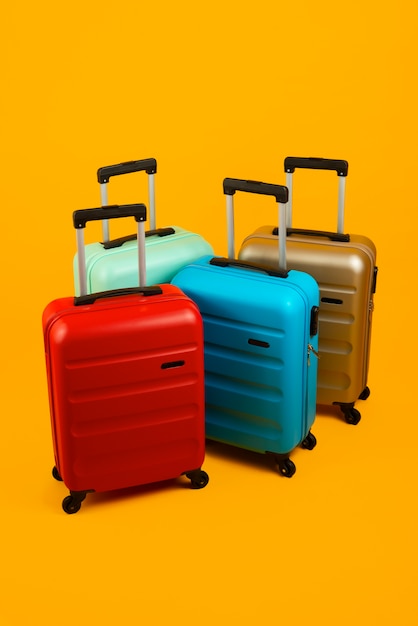
At what (x,y) coordinates should I click in order to perform the action: click on handles. Please return your answer as a coordinate pair (x, y). Looking at the image, I should click on [118, 216], [125, 167], [263, 182], [324, 158].